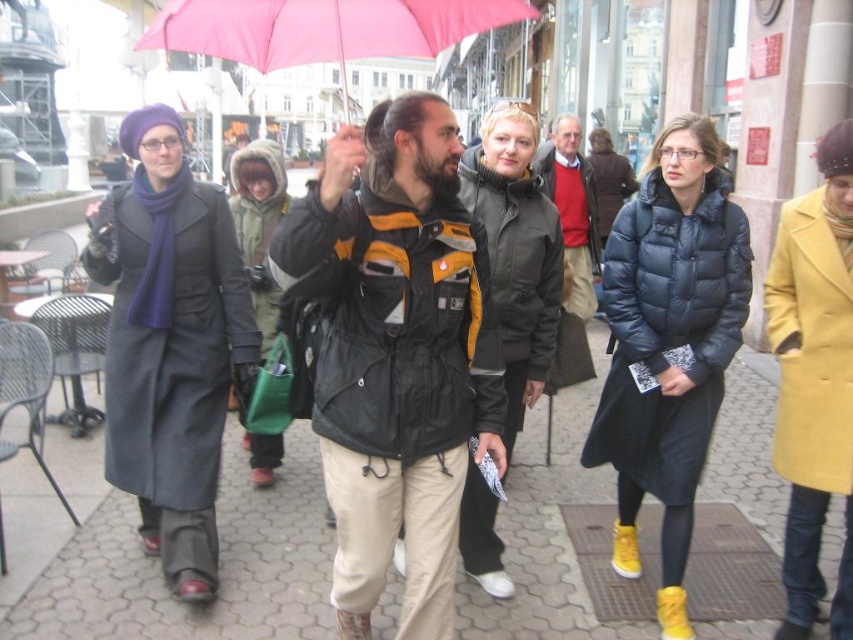
Does black leather jacket at center appear over brown cobblestone pavement at center?

Yes.

The image size is (853, 640). What do you see at coordinates (396, 353) in the screenshot?
I see `black leather jacket at center` at bounding box center [396, 353].

Is point (375, 556) behind point (596, 381)?

No, (375, 556) is in front of (596, 381).

The width and height of the screenshot is (853, 640). Identify the location of black leather jacket at center. (396, 353).

Looking at this image, is brown cobblestone pavement at center taller than pink fabric umbrella at upper center?

No.

Can you confirm if brown cobblestone pavement at center is positioned below pink fabric umbrella at upper center?

Yes.

Does point (71, 605) come farther from viewer compared to point (415, 3)?

No.

Locate an element on the screen. brown cobblestone pavement at center is located at coordinates (219, 568).

Does point (405, 420) come in front of point (158, 385)?

Yes, point (405, 420) is closer to viewer.

Can you confirm if black leather jacket at center is positioned below dark gray wool coat at left?

Yes, black leather jacket at center is below dark gray wool coat at left.

Is point (436, 136) positioned after point (144, 220)?

No, (436, 136) is in front of (144, 220).

Where is `black leather jacket at center`? The image size is (853, 640). black leather jacket at center is located at coordinates (396, 353).